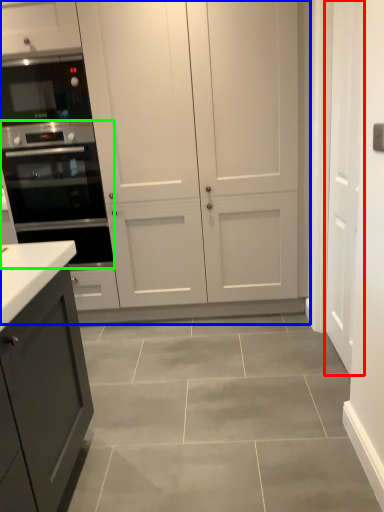
Question: Estimate the real-world distances between objects in this image. Which object is closer to door (highlighted by a red box), cupboard (highlighted by a blue box) or oven (highlighted by a green box)?

Choices:
 (A) cupboard
 (B) oven

Answer: (A)